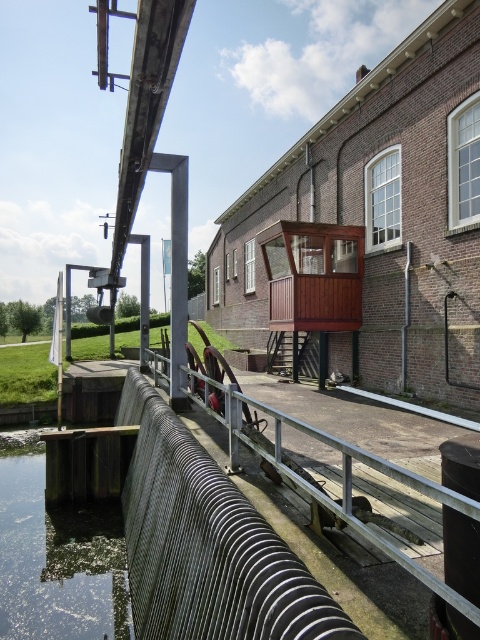
Looking at this image, you are standing at the historic watermill and want to determine which of the two points, point (27,433) or point (166,358), is closer to you. Based on the scene, can you identify which point is nearer?

Point (27,433) is closer to you because it is further to the viewer than point (166,358).